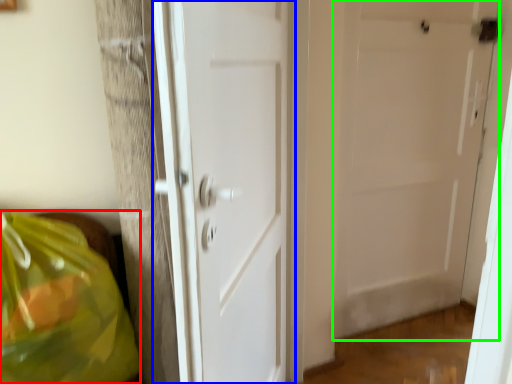
Question: Which object is the farthest from grocery bag (highlighted by a red box)? Choose among these: door (highlighted by a blue box) or door (highlighted by a green box).

Choices:
 (A) door
 (B) door

Answer: (B)